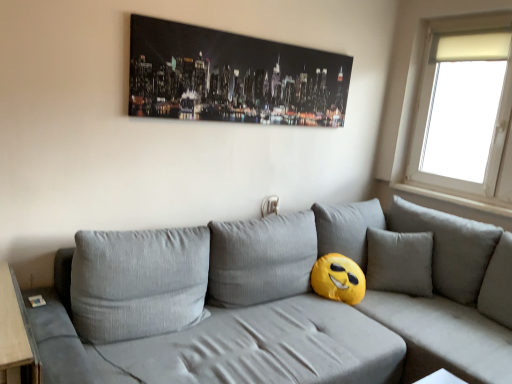
This screenshot has width=512, height=384. I want to click on empty space that is ontop of black glossy canvas at upper center (from a real-world perspective), so click(x=260, y=37).